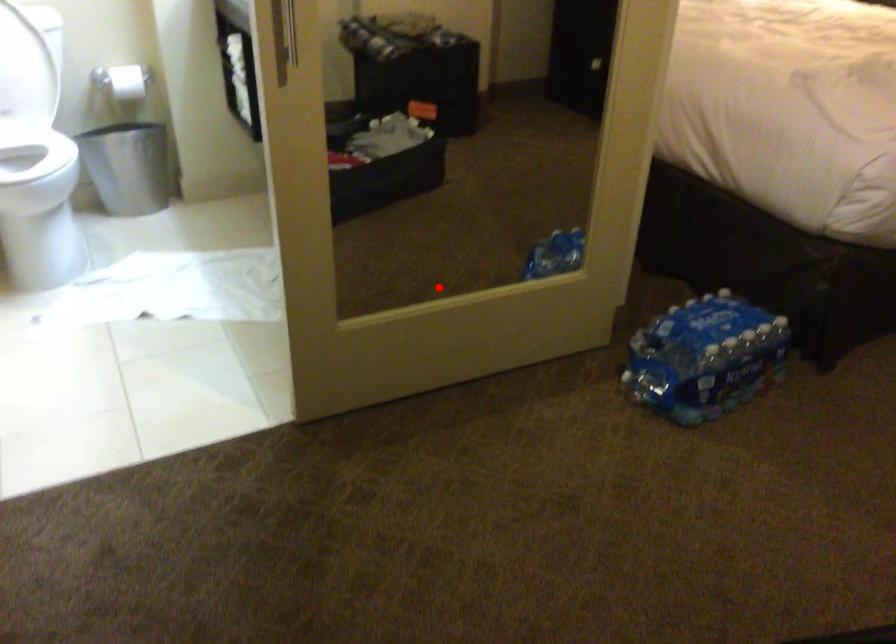
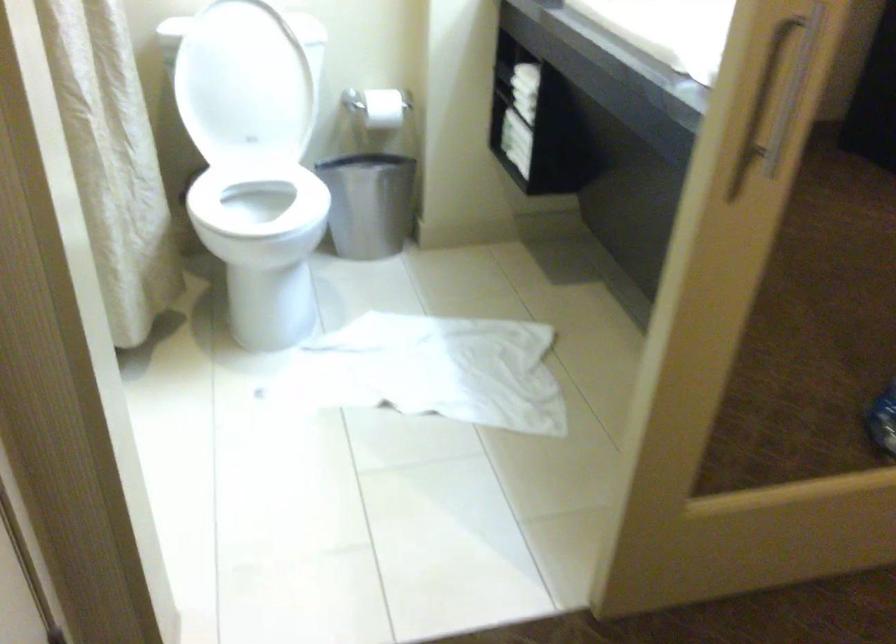
Question: I am providing you with two images of the same scene from different viewpoints. Given a red point in image1, look at the same physical point in image2. Is it:

Choices:
 (A) Closer to the viewpoint
 (B) Farther from the viewpoint

Answer: (A)